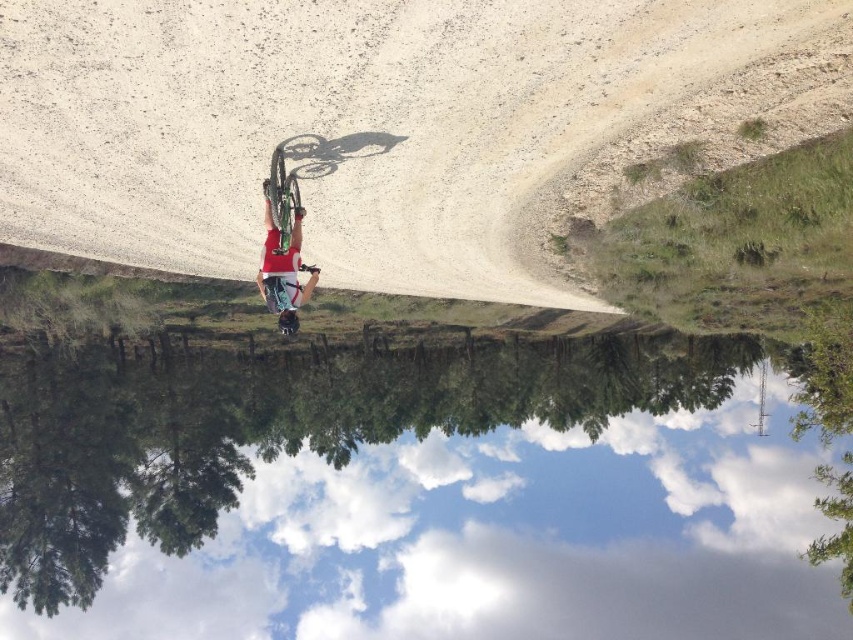
This screenshot has height=640, width=853. Find the location of `transparent glass lake at center`. transparent glass lake at center is located at coordinates (410, 496).

Does transparent glass lake at center appear over brown gravel dirt track at upper center?

Incorrect, transparent glass lake at center is not positioned above brown gravel dirt track at upper center.

This screenshot has width=853, height=640. What do you see at coordinates (410, 496) in the screenshot?
I see `transparent glass lake at center` at bounding box center [410, 496].

The width and height of the screenshot is (853, 640). Identify the location of transparent glass lake at center. (410, 496).

Can you confirm if transparent glass lake at center is thinner than green matte bicycle at center?

In fact, transparent glass lake at center might be wider than green matte bicycle at center.

Image resolution: width=853 pixels, height=640 pixels. Find the location of `transparent glass lake at center`. transparent glass lake at center is located at coordinates (410, 496).

The height and width of the screenshot is (640, 853). Describe the element at coordinates (410, 496) in the screenshot. I see `transparent glass lake at center` at that location.

Locate an element on the screen. transparent glass lake at center is located at coordinates (410, 496).

Which is more to the left, brown gravel dirt track at upper center or green matte bicycle at center?

brown gravel dirt track at upper center is more to the left.

Who is more forward, (221, 104) or (271, 205)?

Point (221, 104) is in front.

The image size is (853, 640). I want to click on brown gravel dirt track at upper center, so click(x=343, y=124).